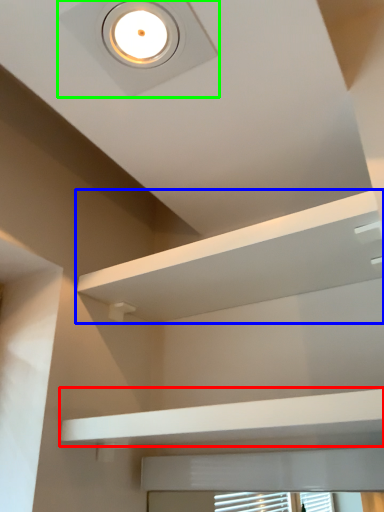
Question: Which object is the farthest from balustrade (highlighted by a red box)? Choose among these: shelf (highlighted by a blue box) or droplight (highlighted by a green box).

Choices:
 (A) shelf
 (B) droplight

Answer: (B)